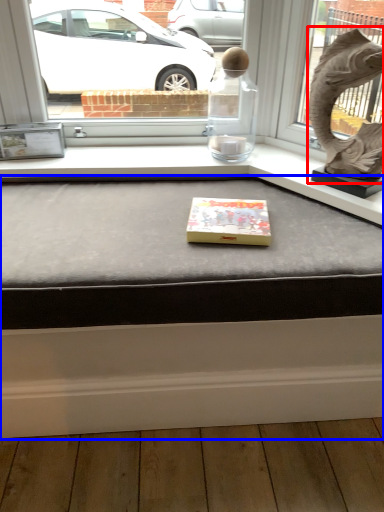
Question: Which of the following is the closest to the observer, animal sculpture (highlighted by a red box) or table (highlighted by a blue box)?

Choices:
 (A) animal sculpture
 (B) table

Answer: (B)